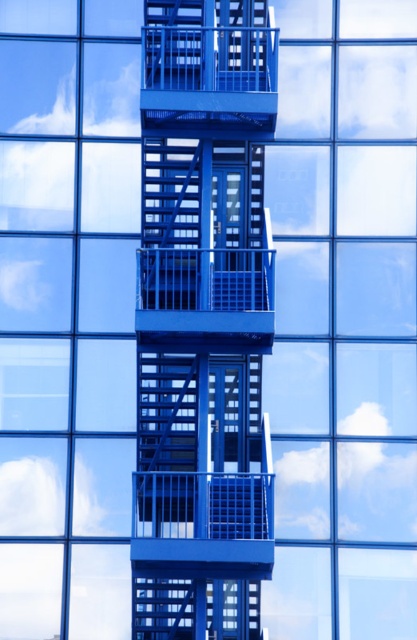
You are standing at point A, which is at the location of point (x=163, y=316). You want to walk to point B, which is 47.67 meters away from point A. Given that the fire escape has a grid pattern with open spaces between bars, can you walk directly from point A to point B without encountering any obstacles?

Yes, you can walk directly from point A to point B because the fire escape has a grid pattern with open spaces between bars, allowing unobstructed passage between points that are 47.67 meters apart.

You are standing in front of a modern glass building with a blue metal fire escape. You notice a point marked at coordinates (x=203, y=321). What does this point indicate?

The point at coordinates (x=203, y=321) marks the location of the metallic blue fire escape at center.